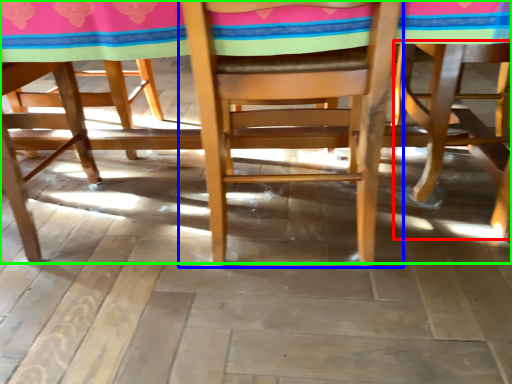
Question: Which object is positioned closest to chair (highlighted by a red box)? Select from chair (highlighted by a blue box) and table (highlighted by a green box).

Choices:
 (A) chair
 (B) table

Answer: (B)